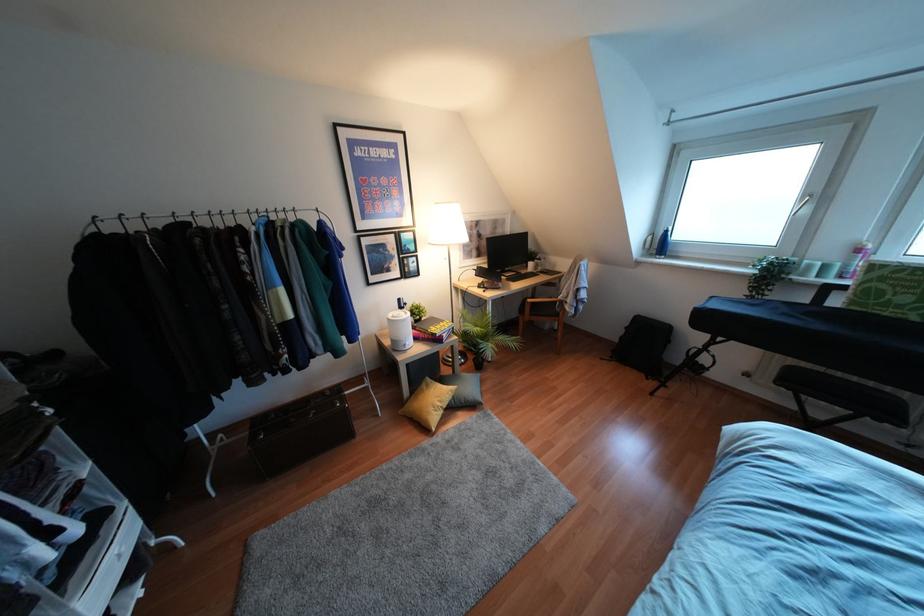
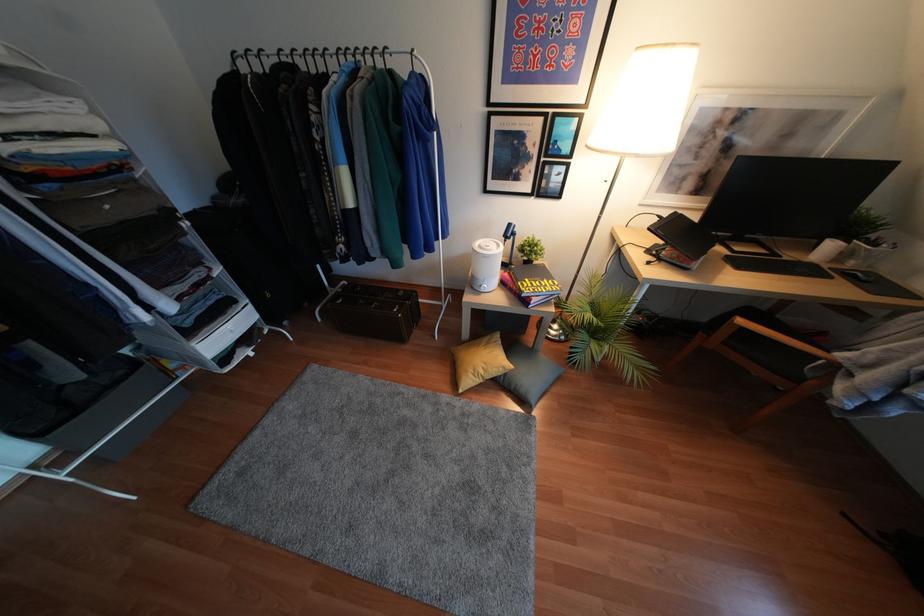
From the picture: How did the camera likely rotate?

The rotation direction of the camera is left-down.